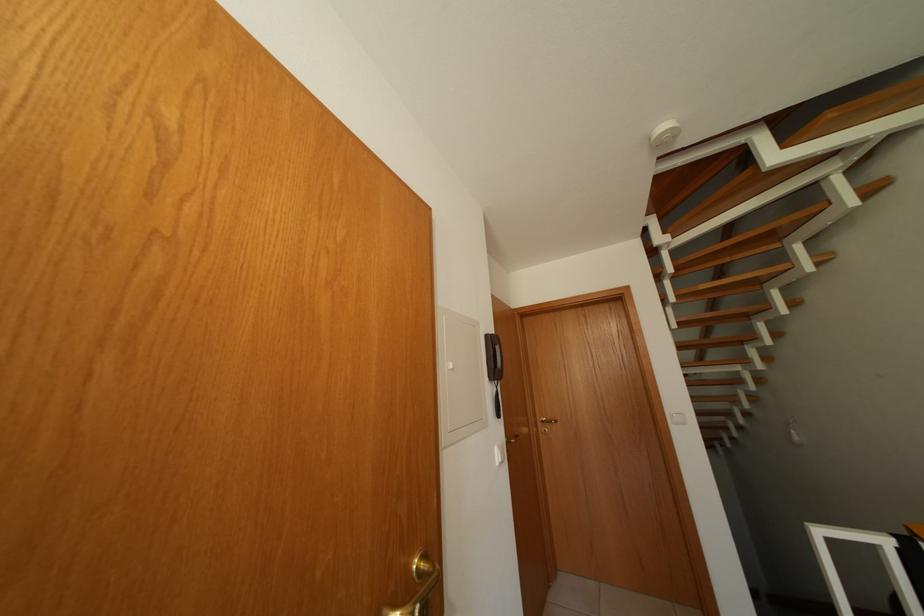
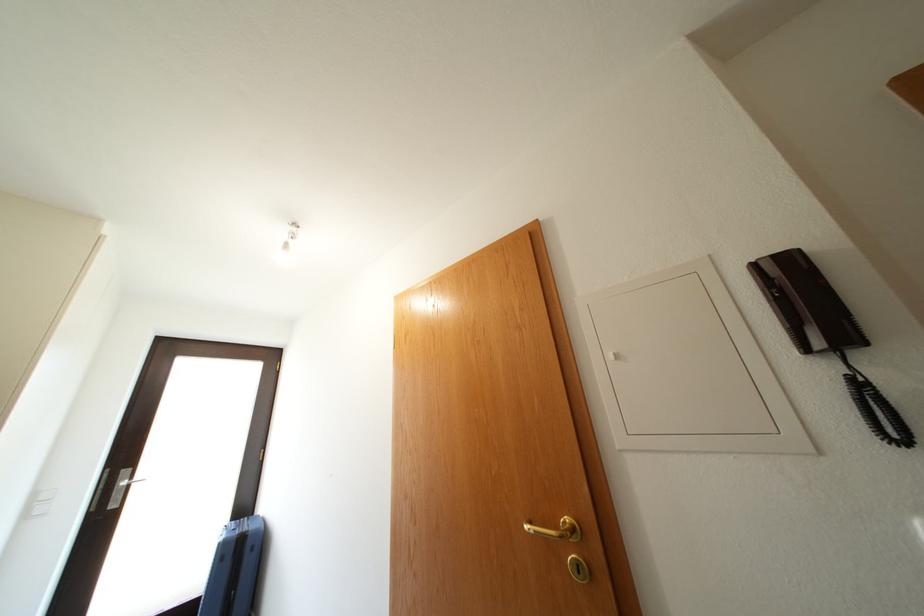
How did the camera likely rotate?

The camera rotated toward left-up.